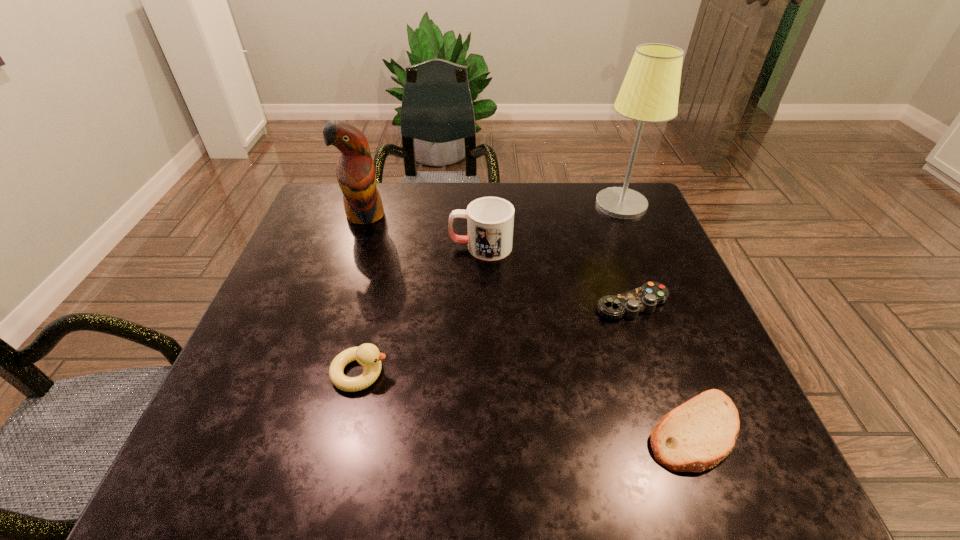
In order to click on vacant space in between the control and the pita bread in this screenshot , I will do `click(663, 367)`.

The height and width of the screenshot is (540, 960). Identify the location of unoccupied area between the pita bread and the control. (663, 367).

I want to click on unoccupied position between the pita bread and the fourth tallest object, so click(x=527, y=401).

I want to click on free space that is in between the second tallest object and the fourth tallest object, so tap(363, 294).

You are a GUI agent. You are given a task and a screenshot of the screen. Output one action in this format:
    pyautogui.click(x=<x>, y=<y>)
    Task: Click on the vacant space that is in between the mug and the control
    Image resolution: width=960 pixels, height=540 pixels.
    Given the screenshot: What is the action you would take?
    coord(557,275)

Locate an element on the screen. This screenshot has width=960, height=540. free point between the duckling and the third farthest object is located at coordinates (420, 309).

Find the location of `free area in between the pita bread and the third tallest object`. free area in between the pita bread and the third tallest object is located at coordinates (588, 339).

What are the coordinates of `empty space that is in between the pita bread and the third object from left to right` in the screenshot? It's located at (588, 339).

Locate an element on the screen. empty location between the table lamp and the pita bread is located at coordinates (658, 318).

Locate an element on the screen. This screenshot has height=540, width=960. object that is the third nearest to the fourth tallest object is located at coordinates (645, 298).